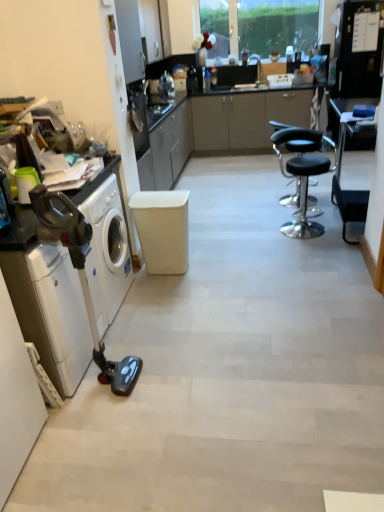
Question: Is white glossy washing machine at left, marked as the second washing machine in a front-to-back arrangement, inside the boundaries of black leather stool at center, or outside?

Choices:
 (A) inside
 (B) outside

Answer: (B)

Question: From a real-world perspective, is white glossy washing machine at left, marked as the second washing machine in a front-to-back arrangement, above or below black leather stool at center?

Choices:
 (A) above
 (B) below

Answer: (A)

Question: Considering the real-world distances, which object is closest to the white plastic washing machine at left, the first washing machine from the front?

Choices:
 (A) black leather stool at center
 (B) metallic gray vacuum cleaner at left
 (C) black plastic table at right
 (D) white matte stool at center
 (E) white glossy washing machine at left, marked as the second washing machine in a front-to-back arrangement

Answer: (B)

Question: Considering the real-world distances, which object is closest to the white plastic washing machine at left, the first washing machine from the front?

Choices:
 (A) white matte stool at center
 (B) black plastic table at right
 (C) white glossy washing machine at left, marked as the second washing machine in a front-to-back arrangement
 (D) metallic gray vacuum cleaner at left
 (E) black leather stool at center

Answer: (D)